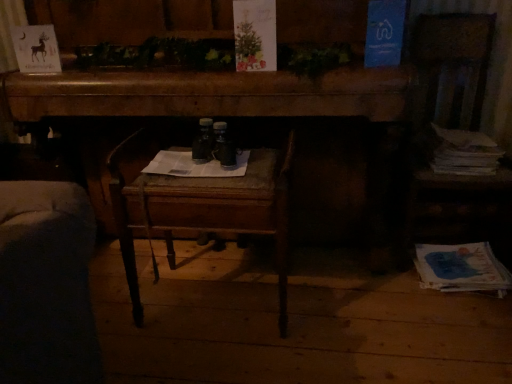
Find the location of a particular element. The width and height of the screenshot is (512, 384). vacant space underneath wooden desk at center (from a real-world perspective) is located at coordinates (233, 260).